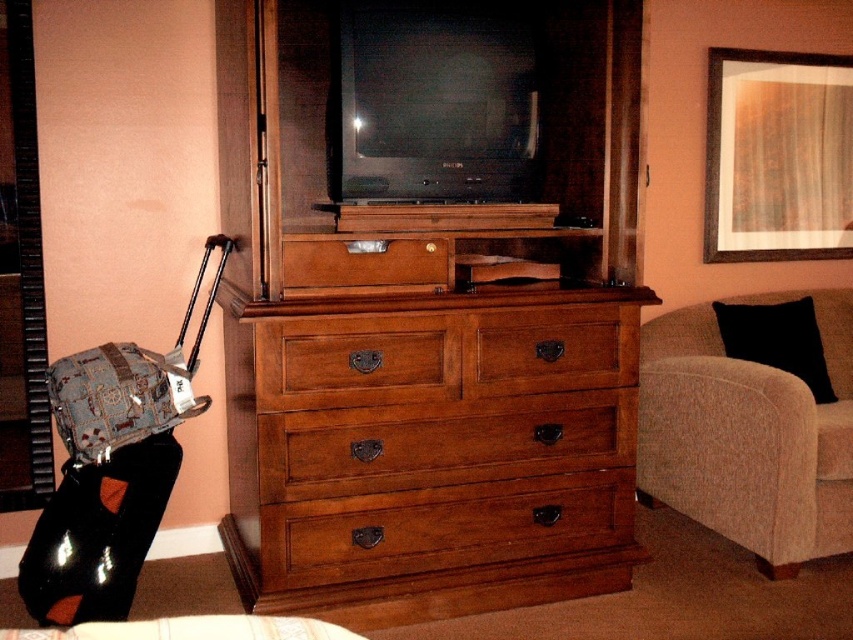
You are standing in the hotel room and want to place a small lamp on the wooden dresser at center. Based on the coordinates provided, can you confirm if the point marked at [431,304] is indeed where the wooden dresser at center is located?

Yes, the point marked at [431,304] corresponds to the location of the wooden dresser at center as described.

You are standing at the entrance of the room and want to sit down on the beige fabric couch at right. Which direction should you walk to reach it?

You should walk to the right to reach the beige fabric couch at right since it is located at the right side of the room.

You are standing in a hotel room and want to take a photo of the wooden dresser at center with your camera. The camera requires a minimum distance of 2 meters to focus properly. Can you take a clear photo from your current position?

The wooden dresser at center and camera are 2.06 meters apart from each other. Since the minimum required distance is 2 meters, you can take a clear photo as the distance is sufficient.